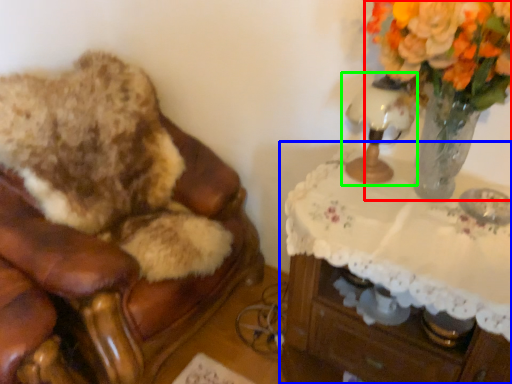
Question: Which is farther away from floral arrangement (highlighted by a red box)? table (highlighted by a blue box) or table lamp (highlighted by a green box)?

Choices:
 (A) table
 (B) table lamp

Answer: (A)